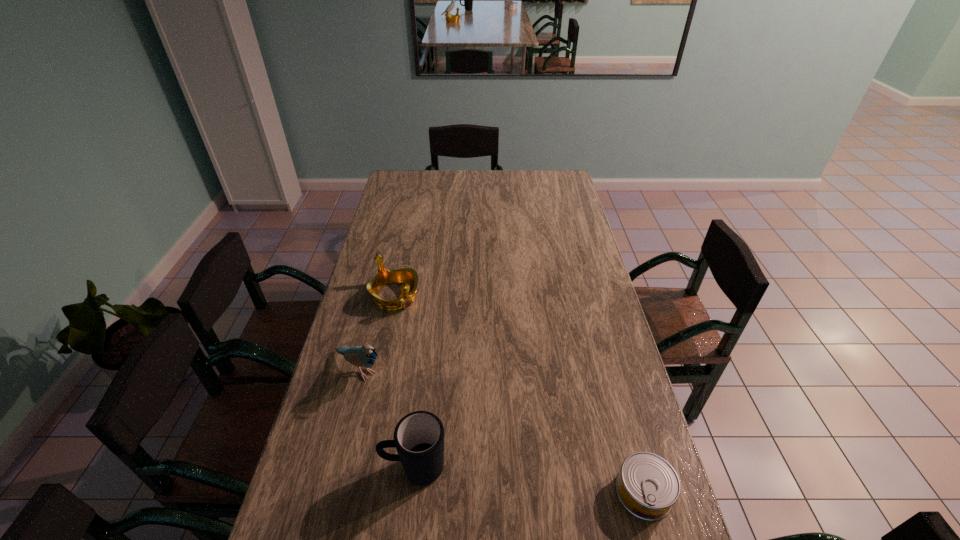
This screenshot has height=540, width=960. In order to click on vacant space located 0.130m at the face of the bird in this screenshot , I will do `click(410, 406)`.

In order to click on free space located at the face of the bird in this screenshot , I will do `click(442, 431)`.

Identify the location of free region located 0.350m at the face of the bird. The height and width of the screenshot is (540, 960). (469, 454).

The image size is (960, 540). I want to click on vacant region located at the front emblem of the tiara, so click(426, 333).

At what (x,y) coordinates should I click in order to perform the action: click on vacant space located at the front emblem of the tiara. Please return your answer as a coordinate pair (x, y). The image size is (960, 540). Looking at the image, I should click on (459, 372).

The height and width of the screenshot is (540, 960). In order to click on vacant space located at the front emblem of the tiara in this screenshot , I will do `click(436, 345)`.

The height and width of the screenshot is (540, 960). I want to click on object that is positioned at the near edge, so click(x=647, y=486).

Locate an element on the screen. bird at the left edge is located at coordinates (361, 356).

Image resolution: width=960 pixels, height=540 pixels. Find the location of `tiara present at the left edge`. tiara present at the left edge is located at coordinates pyautogui.click(x=408, y=276).

Where is `object situated at the right edge`? This screenshot has height=540, width=960. object situated at the right edge is located at coordinates 647,486.